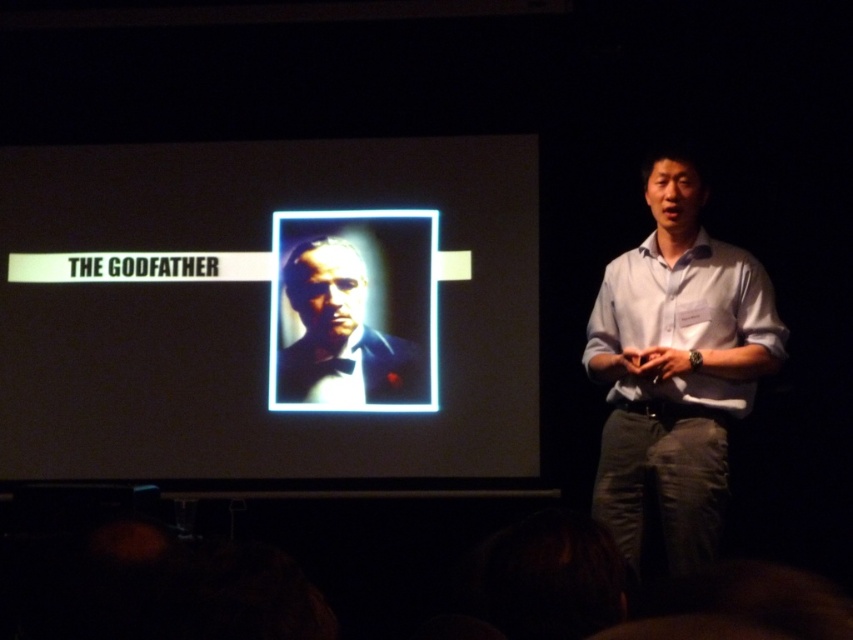
Question: Which object appears closest to the camera in this image?

Choices:
 (A) white shirt at center
 (B) white cotton shirt at right

Answer: (A)

Question: Does white cotton shirt at right have a greater width compared to matte black suit at center?

Choices:
 (A) yes
 (B) no

Answer: (B)

Question: Is white shirt at center wider than matte black suit at center?

Choices:
 (A) yes
 (B) no

Answer: (B)

Question: Among these points, which one is nearest to the camera?

Choices:
 (A) (693, 468)
 (B) (142, 227)
 (C) (318, 248)
 (D) (726, 397)

Answer: (A)

Question: Is white cotton shirt at right below matte black suit at center?

Choices:
 (A) yes
 (B) no

Answer: (B)

Question: Which point is farther from the camera taking this photo?

Choices:
 (A) (315, 294)
 (B) (631, 285)

Answer: (A)